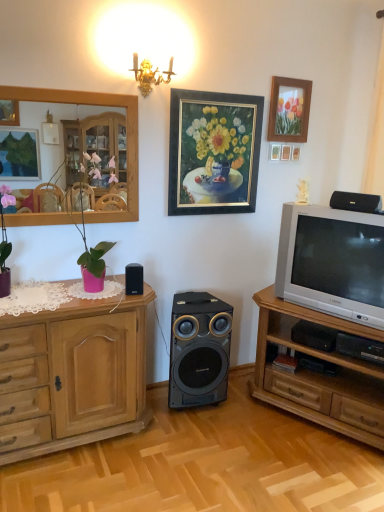
Question: From a real-world perspective, is wooden cabinet at left beneath silver metallic television at right?

Choices:
 (A) no
 (B) yes

Answer: (B)

Question: Is wooden cabinet at left facing away from silver metallic television at right?

Choices:
 (A) no
 (B) yes

Answer: (A)

Question: Are wooden cabinet at left and silver metallic television at right far apart?

Choices:
 (A) yes
 (B) no

Answer: (A)

Question: Can you confirm if wooden cabinet at left is positioned to the left of silver metallic television at right?

Choices:
 (A) no
 (B) yes

Answer: (B)

Question: Is wooden cabinet at left closer to the viewer compared to silver metallic television at right?

Choices:
 (A) yes
 (B) no

Answer: (A)

Question: From a real-world perspective, is black plastic speaker at center, which ranks as the first loudspeaker in left-to-right order, above or below wooden cabinet at right?

Choices:
 (A) below
 (B) above

Answer: (B)

Question: Visually, is black plastic speaker at center, the 2th loudspeaker in the front-to-back sequence, positioned to the left or to the right of wooden cabinet at right?

Choices:
 (A) right
 (B) left

Answer: (B)

Question: Is black plastic speaker at center, arranged as the third loudspeaker when viewed from the right, inside the boundaries of wooden cabinet at right, or outside?

Choices:
 (A) outside
 (B) inside

Answer: (A)

Question: Is black plastic speaker at center, the 2th loudspeaker in the front-to-back sequence, taller or shorter than wooden cabinet at right?

Choices:
 (A) tall
 (B) short

Answer: (B)

Question: Which is correct: black plastic speaker at center, marked as the first loudspeaker in a bottom-to-top arrangement, is inside black plastic speaker at upper right, which ranks as the 3th loudspeaker in left-to-right order, or outside of it?

Choices:
 (A) outside
 (B) inside

Answer: (A)

Question: Is black plastic speaker at center, acting as the first loudspeaker starting from the back, in front of or behind black plastic speaker at upper right, marked as the 3th loudspeaker in a back-to-front arrangement, in the image?

Choices:
 (A) front
 (B) behind

Answer: (B)

Question: Based on their sizes in the image, would you say black plastic speaker at center, the third loudspeaker viewed from the top, is bigger or smaller than black plastic speaker at upper right, which ranks as the third loudspeaker in bottom-to-top order?

Choices:
 (A) small
 (B) big

Answer: (B)

Question: From the image's perspective, is black plastic speaker at center, the 2th loudspeaker in the right-to-left sequence, located above or below black plastic speaker at upper right, which is the first loudspeaker from front to back?

Choices:
 (A) above
 (B) below

Answer: (B)

Question: Considering the relative positions of wooden picture frame at upper right, acting as the 2th picture frame starting from the left, and wooden mirror at upper left in the image provided, is wooden picture frame at upper right, acting as the 2th picture frame starting from the left, to the left or to the right of wooden mirror at upper left?

Choices:
 (A) right
 (B) left

Answer: (A)

Question: From a real-world perspective, relative to wooden mirror at upper left, is wooden picture frame at upper right, positioned as the 1th picture frame in right-to-left order, vertically above or below?

Choices:
 (A) above
 (B) below

Answer: (A)